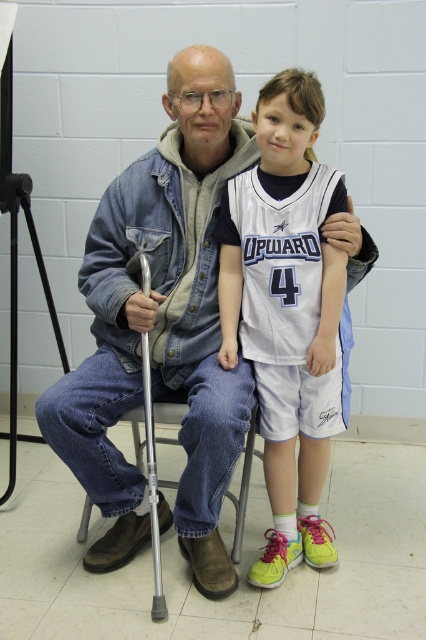
Can you confirm if denim jacket at center is shorter than white jersey at center?

No, denim jacket at center is not shorter than white jersey at center.

Based on the photo, can you confirm if denim jacket at center is positioned to the right of white jersey at center?

No, denim jacket at center is not to the right of white jersey at center.

Where is `denim jacket at center`? This screenshot has height=640, width=426. denim jacket at center is located at coordinates (161, 323).

The height and width of the screenshot is (640, 426). In order to click on denim jacket at center in this screenshot , I will do [x=161, y=323].

Is white jersey at center shorter than silver metallic crutch at left?

Incorrect, white jersey at center's height does not fall short of silver metallic crutch at left's.

Can you confirm if white jersey at center is bigger than silver metallic crutch at left?

Yes.

Where is `white jersey at center`? The width and height of the screenshot is (426, 640). white jersey at center is located at coordinates 287,312.

Can you confirm if denim jacket at center is bigger than silver metallic crutch at left?

Indeed, denim jacket at center has a larger size compared to silver metallic crutch at left.

The width and height of the screenshot is (426, 640). What are the coordinates of `denim jacket at center` in the screenshot? It's located at (161, 323).